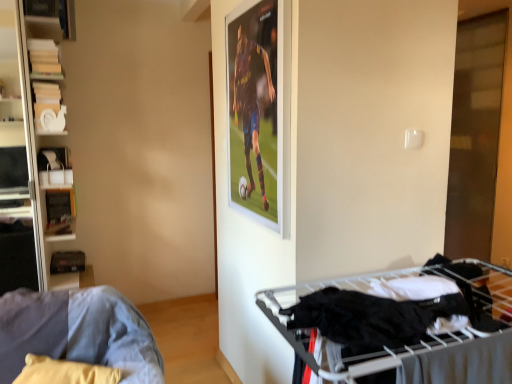
Locate an element on the screen. empty space that is ontop of black fabric at lower right (from a real-world perspective) is located at coordinates (389, 312).